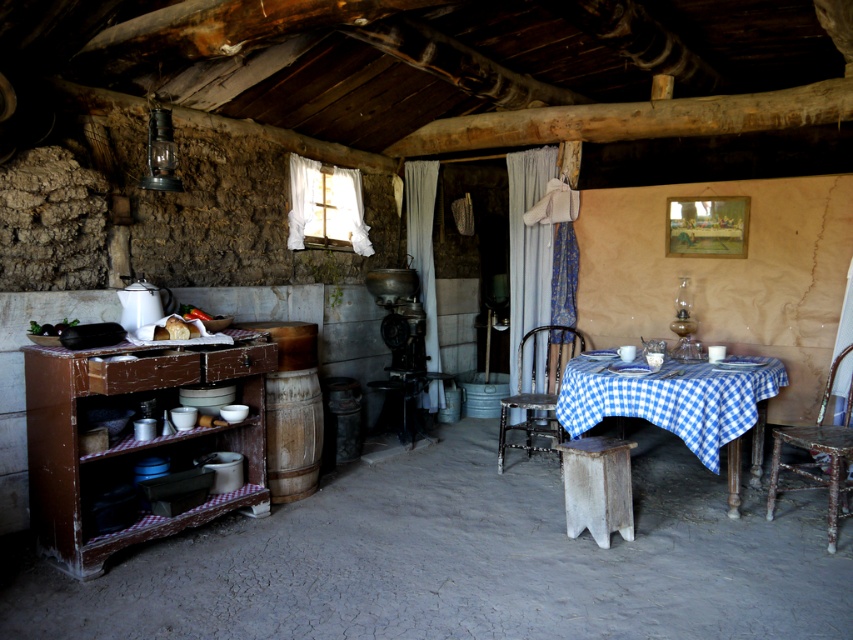
Is wooden stool at center positioned at the back of rusty metal chair at center?

No, it is in front of rusty metal chair at center.

Which is more to the left, wooden stool at center or rusty metal chair at center?

Positioned to the left is rusty metal chair at center.

Does point (596, 452) come in front of point (498, 444)?

Yes, it is.

The width and height of the screenshot is (853, 640). I want to click on wooden stool at center, so click(596, 486).

Who is lower down, wooden table at left or wooden stool at center?

wooden stool at center is below.

Is wooden table at left smaller than wooden stool at center?

No.

Measure the distance between point (257, 340) and camera.

Point (257, 340) is 3.70 meters from camera.

The height and width of the screenshot is (640, 853). Identify the location of wooden table at left. (131, 440).

Is blue checkered tablecloth at center positioned before rusty metal chair at center?

Yes, blue checkered tablecloth at center is in front of rusty metal chair at center.

Who is more distant from viewer, (605, 381) or (531, 444)?

The point (531, 444) is more distant.

Who is more distant from viewer, (656, 378) or (561, 436)?

Positioned behind is point (561, 436).

This screenshot has height=640, width=853. In order to click on blue checkered tablecloth at center in this screenshot , I will do `click(680, 406)`.